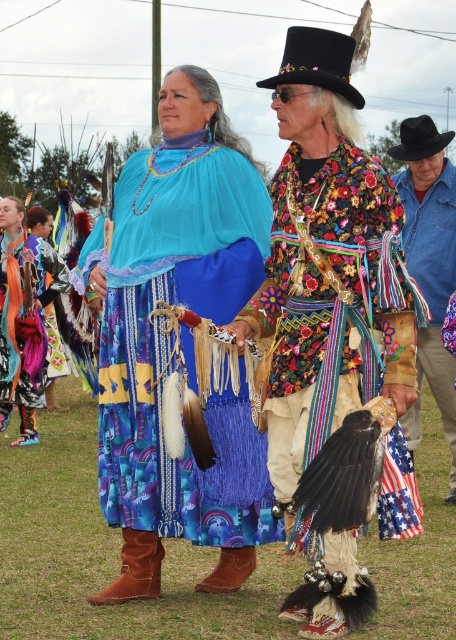
You are standing in the open grassy area and want to find the blue woven skirt at center. Based on the coordinates provided, in which direction should you look relative to your current position?

The blue woven skirt at center is located at coordinates point (x=171, y=340), which corresponds to the center area of the image. Since you are in the open grassy area, you should look straight ahead to find it.